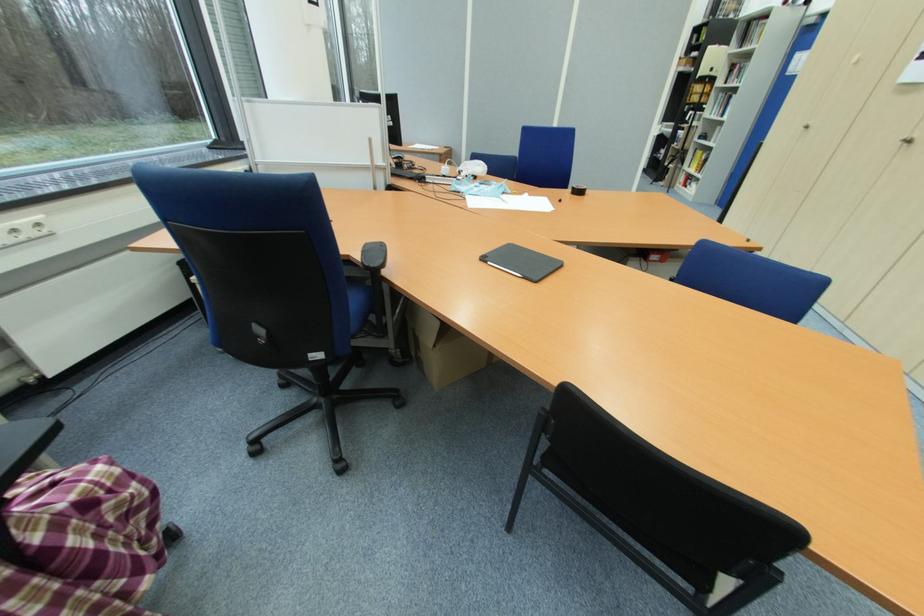
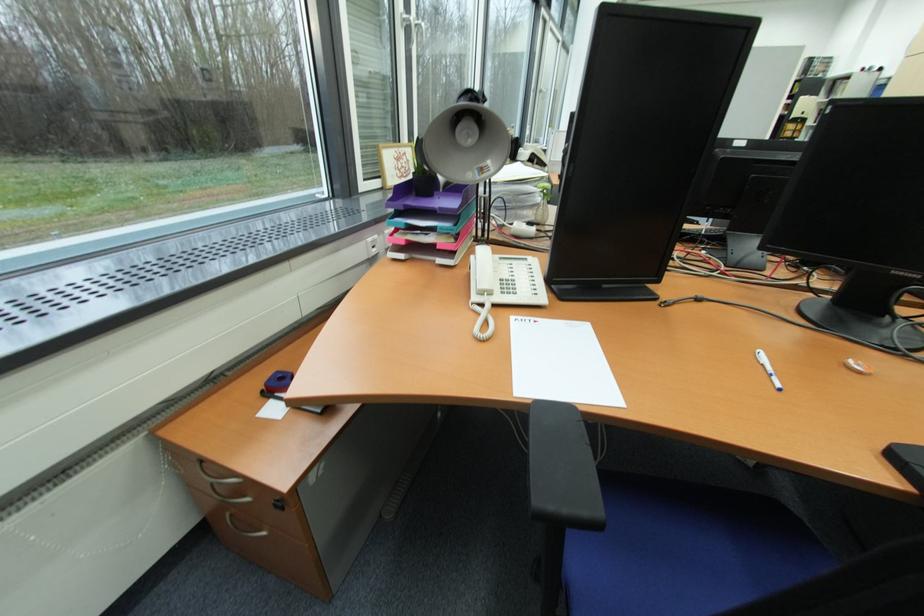
What movement of the cameraman would produce the second image?

The movement direction of the cameraman is left, backward.